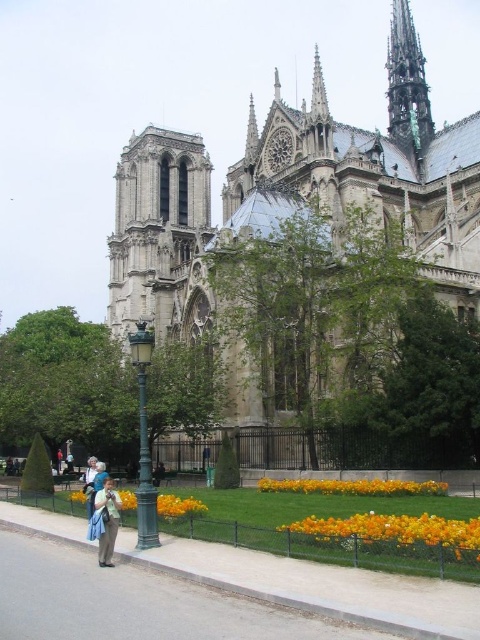
Where is the green copper spire at upper right located in the image?

The green copper spire at upper right is located at point coordinates of (407,84).

You are a tourist standing on the walkway near the black metal fence. You want to take a photo of the green copper spire at upper right without the light brown leather jacket at lower left blocking the view. Is the jacket too close to the spire to be in the frame?

The green copper spire at upper right is much taller than the light brown leather jacket at lower left, so the jacket is unlikely to block the view of the spire in your photo.

Where is the green copper spire at upper right located in the image?

The green copper spire at upper right is located at point coordinates of 0.133 on the x axis and 0.848 on the y axis.